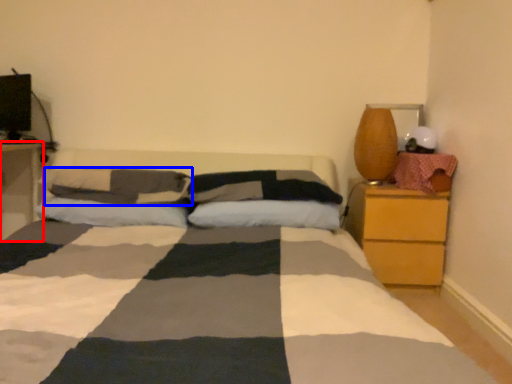
Question: Which of the following is the farthest to the observer, nightstand (highlighted by a red box) or pillow (highlighted by a blue box)?

Choices:
 (A) nightstand
 (B) pillow

Answer: (A)